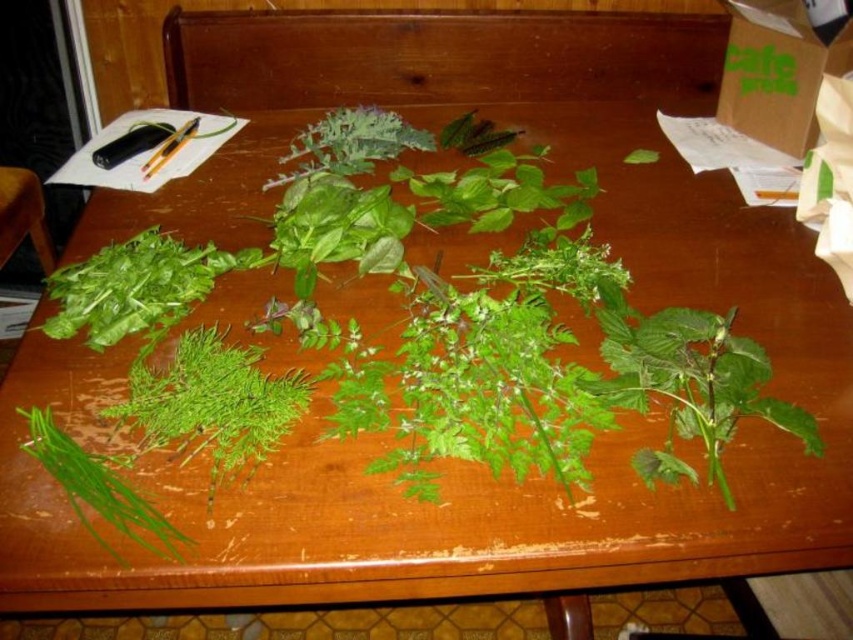
Question: Which of the following is the closest to the observer?

Choices:
 (A) (35, 454)
 (B) (160, 440)

Answer: (A)

Question: Can you confirm if green leafy at left is positioned to the right of green leafy at lower left?

Choices:
 (A) no
 (B) yes

Answer: (B)

Question: Which point is farther from the camera taking this photo?

Choices:
 (A) (267, 404)
 (B) (74, 445)

Answer: (A)

Question: Which point is closer to the camera?

Choices:
 (A) green leafy at left
 (B) green leafy at lower left

Answer: (B)

Question: Is green leafy at left below green leafy at lower left?

Choices:
 (A) no
 (B) yes

Answer: (A)

Question: Is green leafy at left above green leafy at lower left?

Choices:
 (A) no
 (B) yes

Answer: (B)